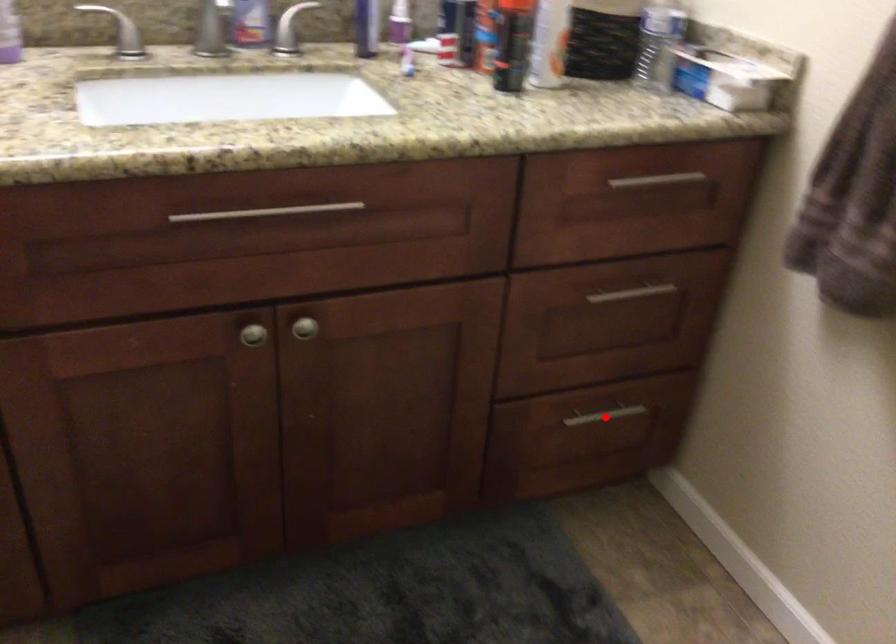
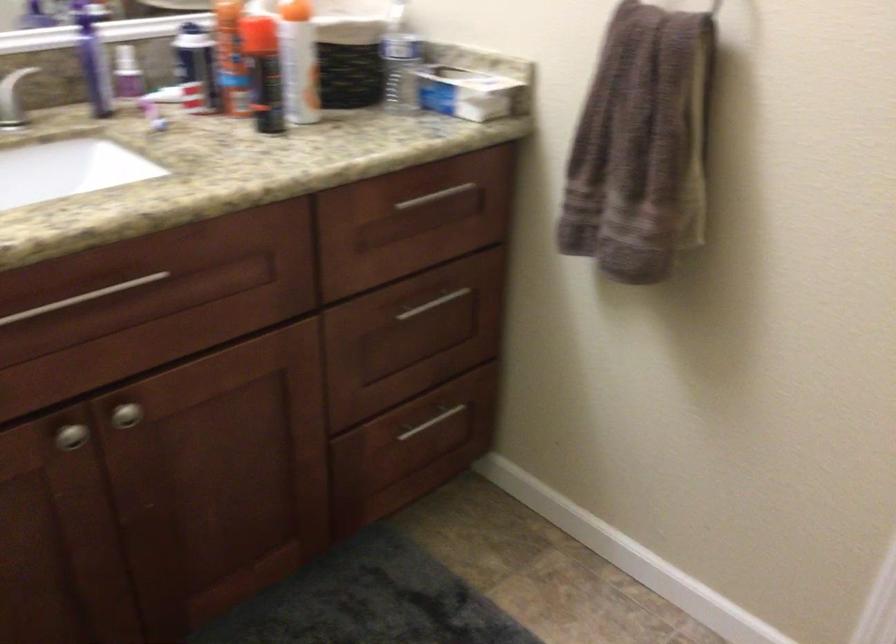
In the second image, find the point that corresponds to the highlighted location in the first image.

(432, 422)